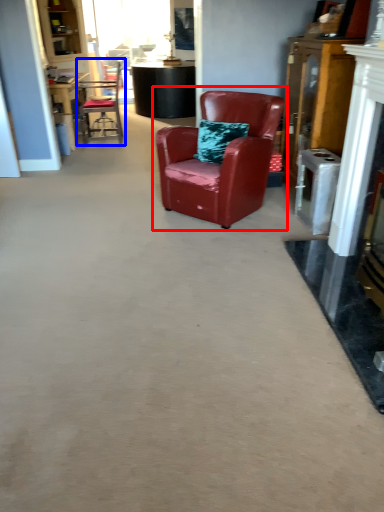
Question: Which object appears farthest to the camera in this image, chair (highlighted by a red box) or chair (highlighted by a blue box)?

Choices:
 (A) chair
 (B) chair

Answer: (B)